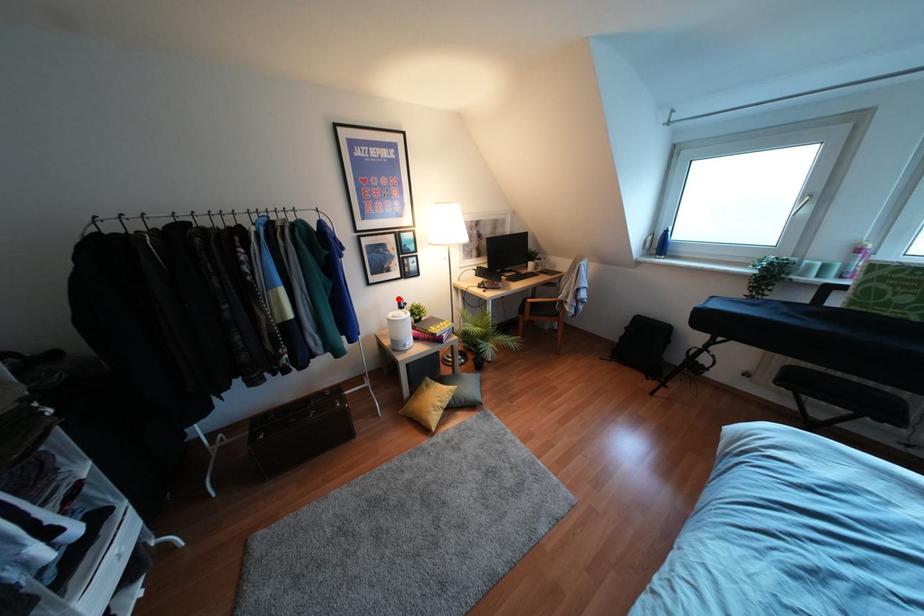
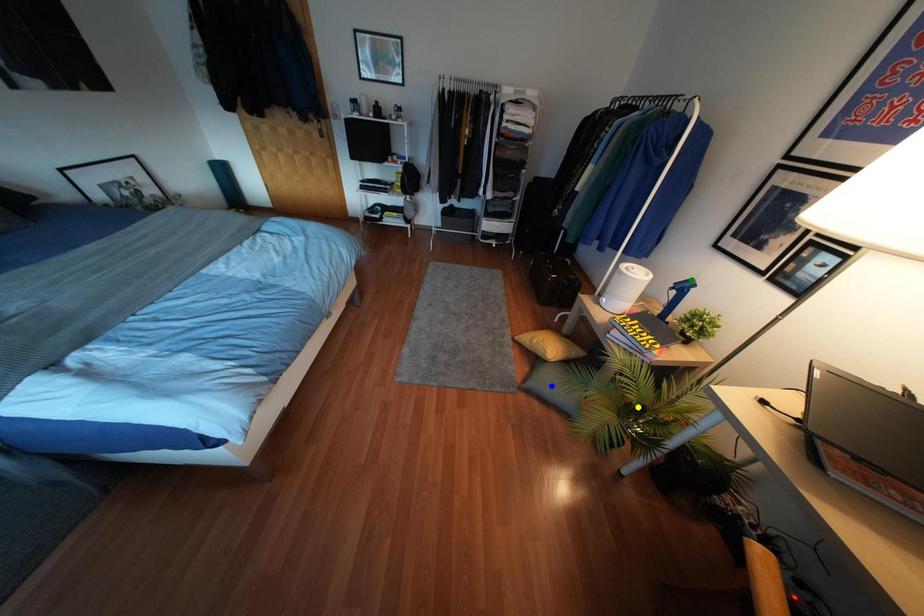
Question: I am providing you with two images of the same scene from different viewpoints. A red point is marked on the first image. You are given multiple points on the second image. In image 2, which mark is for the same physical point as the one in image 1?

Choices:
 (A) yellow point
 (B) green point
 (C) blue point

Answer: (B)